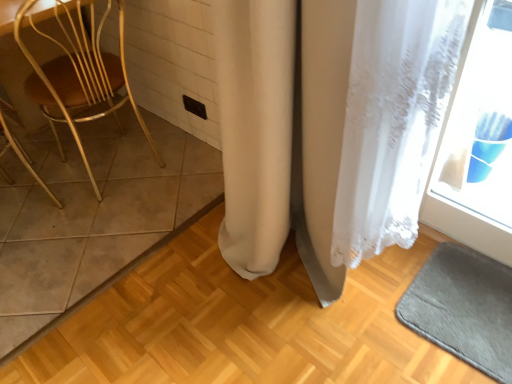
Question: Is white lace curtain at center bigger than brown tile at left?

Choices:
 (A) no
 (B) yes

Answer: (B)

Question: Does white lace curtain at center have a greater height compared to brown tile at left?

Choices:
 (A) yes
 (B) no

Answer: (A)

Question: Is white lace curtain at center completely or partially outside of brown tile at left?

Choices:
 (A) yes
 (B) no

Answer: (A)

Question: Is white lace curtain at center further to the viewer compared to brown tile at left?

Choices:
 (A) yes
 (B) no

Answer: (B)

Question: From the image's perspective, is white lace curtain at center over brown tile at left?

Choices:
 (A) no
 (B) yes

Answer: (A)

Question: Based on their sizes in the image, would you say white lace curtain at center is bigger or smaller than brown tile at left?

Choices:
 (A) small
 (B) big

Answer: (B)

Question: Looking at their shapes, would you say white lace curtain at center is wider or thinner than brown tile at left?

Choices:
 (A) wide
 (B) thin

Answer: (B)

Question: From a real-world perspective, is white lace curtain at center physically located above or below brown tile at left?

Choices:
 (A) above
 (B) below

Answer: (A)

Question: In the image, is white lace curtain at center positioned in front of or behind brown tile at left?

Choices:
 (A) behind
 (B) front

Answer: (B)

Question: Is wooden chair at left taller or shorter than brown tile at left?

Choices:
 (A) short
 (B) tall

Answer: (B)

Question: Relative to brown tile at left, is wooden chair at left in front or behind?

Choices:
 (A) front
 (B) behind

Answer: (A)

Question: From a real-world perspective, relative to brown tile at left, is wooden chair at left vertically above or below?

Choices:
 (A) below
 (B) above

Answer: (B)

Question: Is point (16, 36) closer or farther from the camera than point (69, 192)?

Choices:
 (A) farther
 (B) closer

Answer: (B)

Question: In terms of height, does brown tile at left look taller or shorter compared to wooden chair at left?

Choices:
 (A) short
 (B) tall

Answer: (A)

Question: In the image, is brown tile at left positioned in front of or behind wooden chair at left?

Choices:
 (A) front
 (B) behind

Answer: (B)